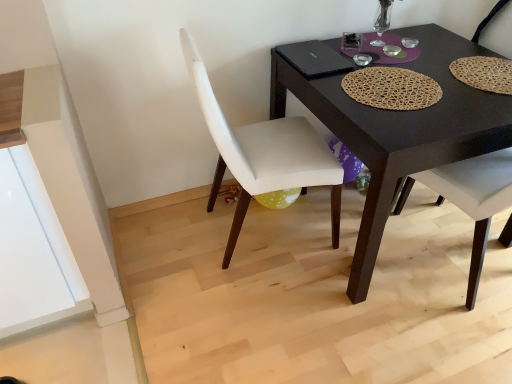
Find the location of a particular element. vacant area situated to the left side of white leather chair at center, which is the 1th chair from left to right is located at coordinates (168, 243).